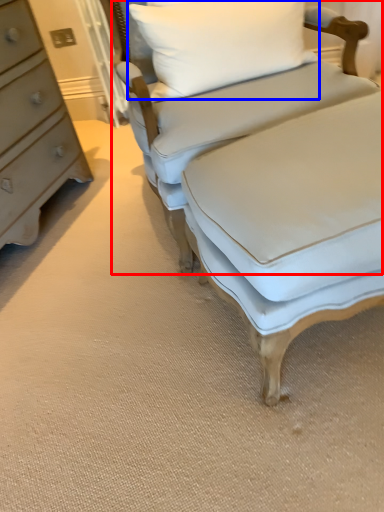
Question: Among these objects, which one is farthest to the camera, studio couch (highlighted by a red box) or pillow (highlighted by a blue box)?

Choices:
 (A) studio couch
 (B) pillow

Answer: (B)